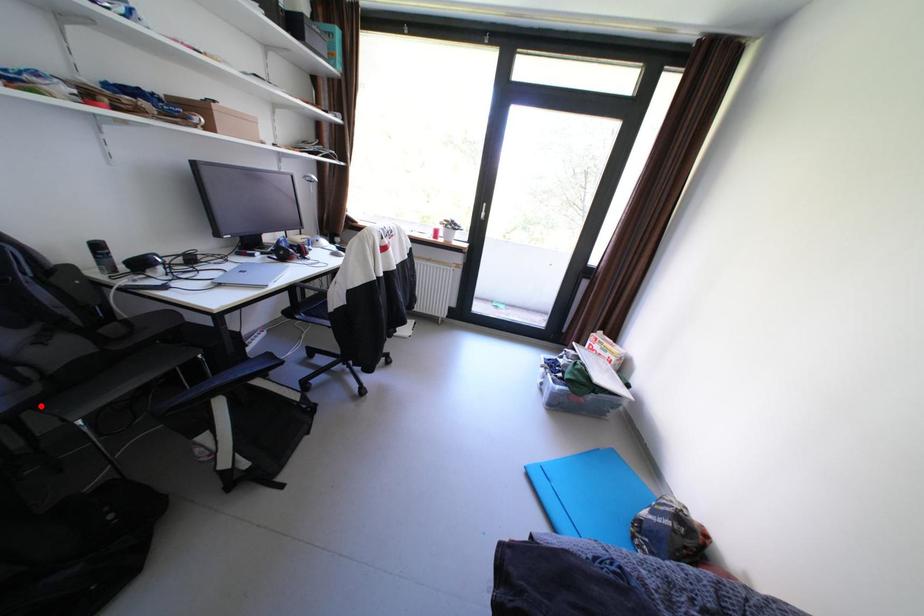
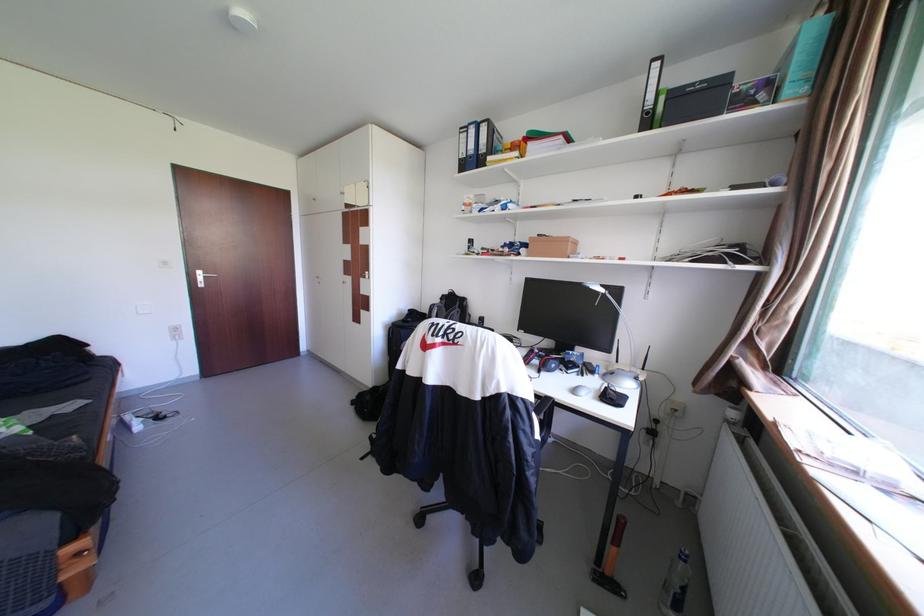
Question: I am providing you with two images of the same scene from different viewpoints. A red point is marked on the first image. Is the red point's position out of view in image 2?

Choices:
 (A) Yes
 (B) No

Answer: (A)